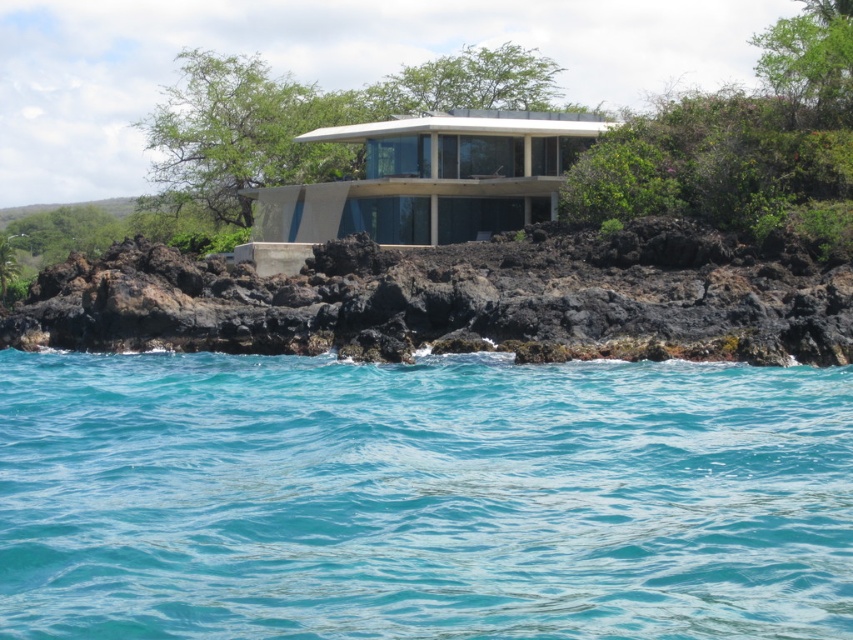
You are standing on the black volcanic rock at center and want to jump into the clear blue water at center. Is the water directly below you?

The clear blue water at center is below the black volcanic rock at center, so yes, the water is directly below you.

You are a photographer planning to capture the clear blue water at center and the black volcanic rock at center from the upper level of the house. Which object will appear narrower in your photo?

The clear blue water at center will appear narrower in the photo because it is thinner than the black volcanic rock at center.